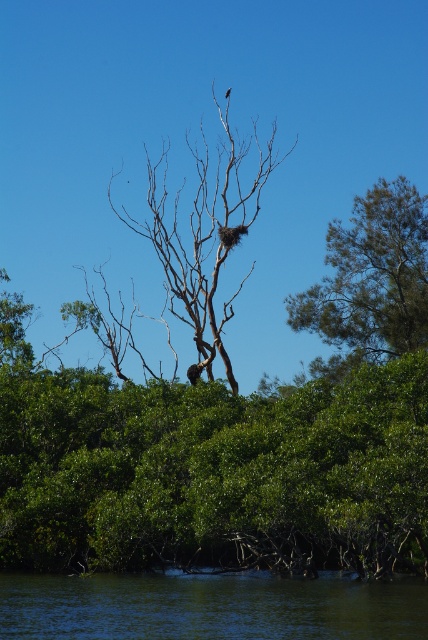
Question: Based on their relative distances, which object is farther from the green leafy tree at upper right?

Choices:
 (A) bare wood tree at upper center
 (B) brown feathered bird at upper center

Answer: (B)

Question: Does green liquid water at lower center appear over bare wood tree at upper center?

Choices:
 (A) yes
 (B) no

Answer: (B)

Question: Which point is farther to the camera?

Choices:
 (A) green liquid water at lower center
 (B) green leafy tree at upper right

Answer: (B)

Question: Is green liquid water at lower center to the left of green leafy tree at upper right from the viewer's perspective?

Choices:
 (A) no
 (B) yes

Answer: (B)

Question: Does bare wood tree at upper center appear under brown feathered bird at upper center?

Choices:
 (A) no
 (B) yes

Answer: (B)

Question: Among these points, which one is nearest to the camera?

Choices:
 (A) coord(273,168)
 (B) coord(419,246)
 (C) coord(225,92)
 (D) coord(413,614)

Answer: (D)